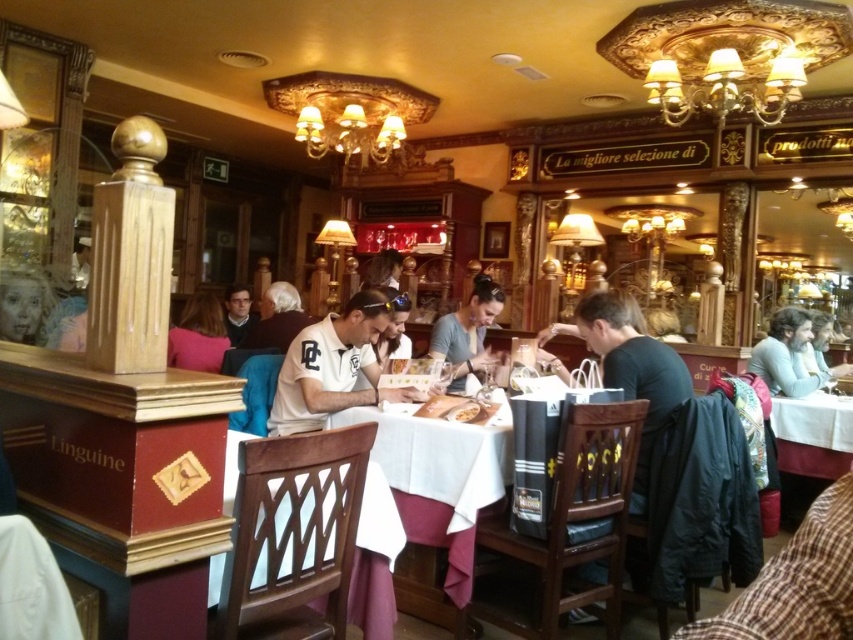
Question: Estimate the real-world distances between objects in this image. Which object is closer to the black matte jacket at lower right?

Choices:
 (A) white matte shirt at center
 (B) gold textured chandelier at upper center

Answer: (A)

Question: Considering the real-world distances, which object is closest to the light blue sweater at right?

Choices:
 (A) matte gray shirt at center
 (B) pink fabric at center
 (C) gold textured chandelier at upper center
 (D) black matte jacket at lower right

Answer: (C)

Question: Does light blue sweater at right have a larger size compared to pink fabric at center?

Choices:
 (A) no
 (B) yes

Answer: (B)

Question: Which point is farther to the camera?

Choices:
 (A) gold textured chandelier at upper center
 (B) smooth gold bust at left

Answer: (B)

Question: Is light blue sweater at right thinner than smooth skin face at center?

Choices:
 (A) no
 (B) yes

Answer: (A)

Question: Does gold textured chandelier at upper center have a smaller size compared to smooth gold bust at left?

Choices:
 (A) yes
 (B) no

Answer: (B)